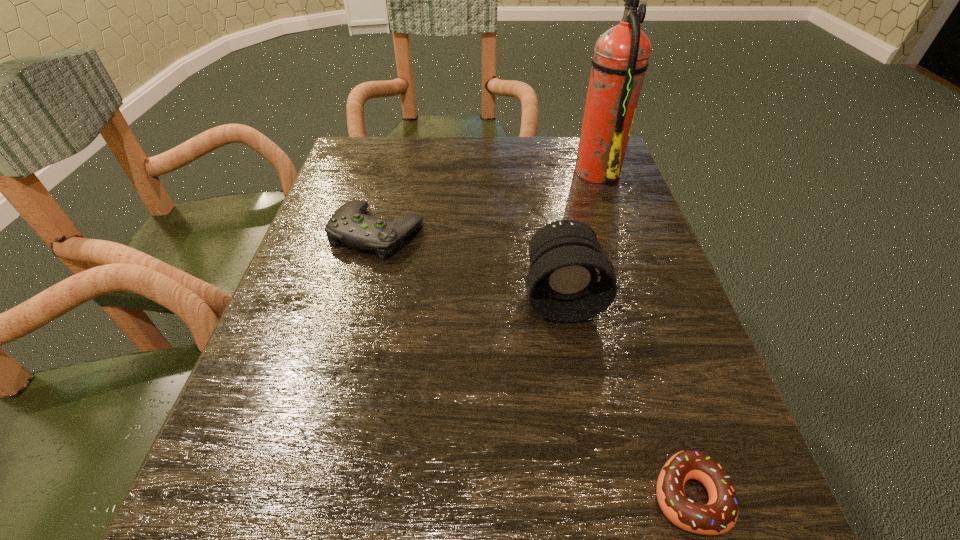
Find the location of a particular element. The image size is (960, 540). object that is at the near right corner is located at coordinates (719, 515).

Locate an element on the screen. vacant space at the far edge of the desktop is located at coordinates (411, 154).

What are the coordinates of `vacant point at the left edge` in the screenshot? It's located at (330, 269).

Identify the location of vacant point at the right edge. This screenshot has height=540, width=960. (614, 389).

In the image, there is a desktop. Find the location of `vacant space at the far left corner`. vacant space at the far left corner is located at coordinates (348, 174).

In order to click on vacant space at the far right corner of the desktop in this screenshot , I will do `click(563, 162)`.

At what (x,y) coordinates should I click in order to perform the action: click on unoccupied area between the nearest object and the fire extinguisher. Please return your answer as a coordinate pair (x, y). This screenshot has height=540, width=960. Looking at the image, I should click on (643, 333).

Locate an element on the screen. This screenshot has height=540, width=960. free space between the second farthest object and the second tallest object is located at coordinates (469, 264).

This screenshot has height=540, width=960. Find the location of `free space between the control and the third farthest object`. free space between the control and the third farthest object is located at coordinates (469, 264).

The width and height of the screenshot is (960, 540). Identify the location of free space between the third farthest object and the doughnut. (626, 395).